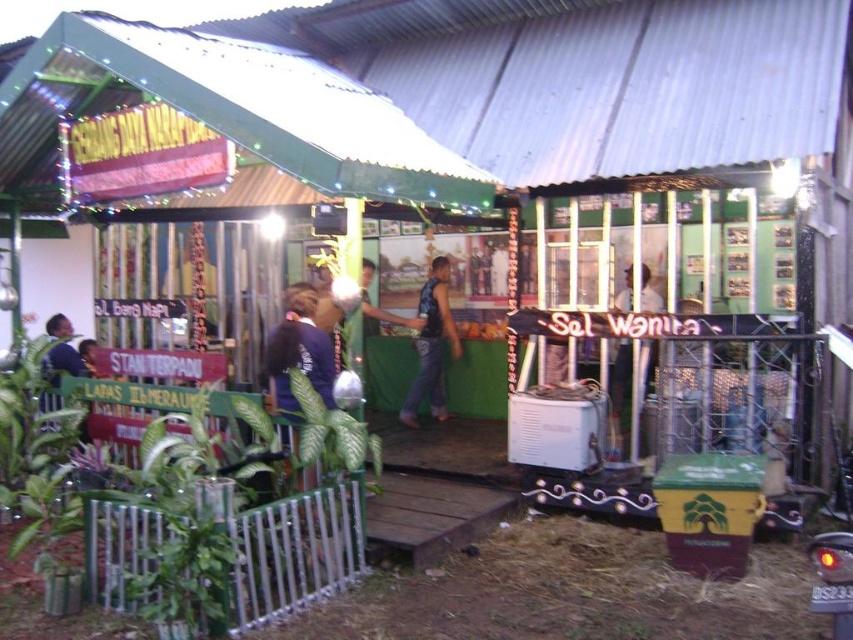
Does dark blue fabric at center appear on the left side of white glossy shirt at center?

Indeed, dark blue fabric at center is positioned on the left side of white glossy shirt at center.

Which is more to the left, dark blue fabric at center or white glossy shirt at center?

Positioned to the left is dark blue fabric at center.

Where is `dark blue fabric at center`? dark blue fabric at center is located at coordinates (299, 352).

Identify the location of dark blue fabric at center. The width and height of the screenshot is (853, 640). (x=299, y=352).

Locate an element on the screen. Image resolution: width=853 pixels, height=640 pixels. dark blue sleeveless shirt at center is located at coordinates (431, 344).

Who is lower down, dark blue sleeveless shirt at center or white glossy shirt at center?

white glossy shirt at center is below.

Is point (451, 353) positioned before point (613, 403)?

No.

Find the location of a particular element. This screenshot has height=640, width=853. dark blue sleeveless shirt at center is located at coordinates pos(431,344).

Based on the photo, can you confirm if dark blue fabric at center is taller than dark blue sleeveless shirt at center?

No.

Identify the location of dark blue fabric at center. The width and height of the screenshot is (853, 640). (299, 352).